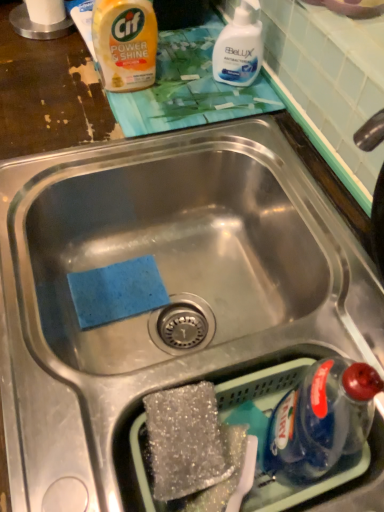
Find the location of a particular element. This screenshot has height=512, width=384. vacant area that lies to the right of yellow plastic bottle at upper left is located at coordinates (199, 90).